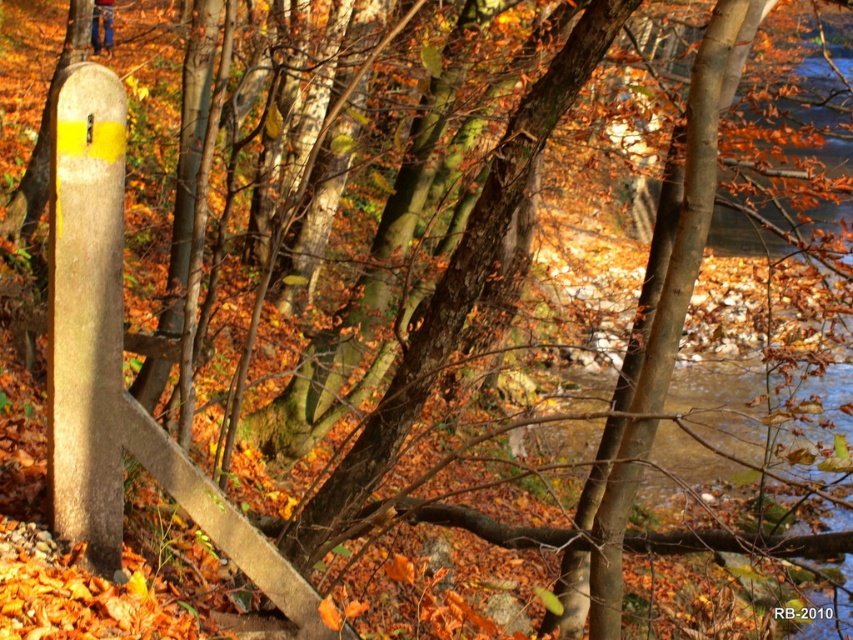
Question: Which object is the farthest from the blue denim jeans at upper left?

Choices:
 (A) brown/wooden river at center right
 (B) smooth concrete post at left

Answer: (B)

Question: Does smooth concrete post at left have a larger size compared to brown/wooden river at center right?

Choices:
 (A) yes
 (B) no

Answer: (B)

Question: Considering the relative positions of brown/wooden river at center right and blue denim jeans at upper left in the image provided, where is brown/wooden river at center right located with respect to blue denim jeans at upper left?

Choices:
 (A) right
 (B) left

Answer: (A)

Question: Which object is farther from the camera taking this photo?

Choices:
 (A) blue denim jeans at upper left
 (B) smooth concrete post at left
 (C) brown/wooden river at center right

Answer: (A)

Question: Can you confirm if brown/wooden river at center right is positioned above blue denim jeans at upper left?

Choices:
 (A) no
 (B) yes

Answer: (A)

Question: Which of the following is the closest to the observer?

Choices:
 (A) smooth concrete post at left
 (B) brown/wooden river at center right

Answer: (B)